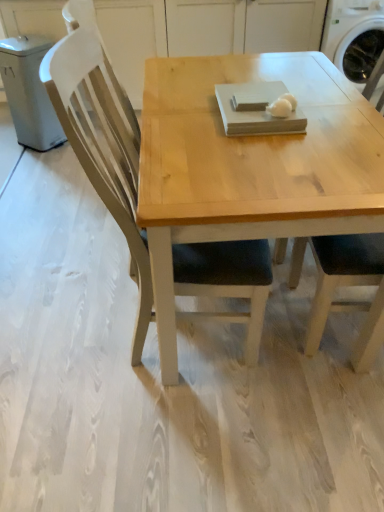
Question: Does white plastic washing machine at upper right have a larger size compared to white matte egg at center?

Choices:
 (A) no
 (B) yes

Answer: (B)

Question: Does white plastic washing machine at upper right have a lesser height compared to white matte egg at center?

Choices:
 (A) yes
 (B) no

Answer: (B)

Question: Considering the relative positions of white plastic washing machine at upper right and white matte egg at center in the image provided, is white plastic washing machine at upper right to the left of white matte egg at center from the viewer's perspective?

Choices:
 (A) no
 (B) yes

Answer: (A)

Question: Is white plastic washing machine at upper right positioned behind white matte egg at center?

Choices:
 (A) yes
 (B) no

Answer: (A)

Question: Can you confirm if white plastic washing machine at upper right is smaller than white matte egg at center?

Choices:
 (A) no
 (B) yes

Answer: (A)

Question: From the image's perspective, is matte wood chair at right above or below white plastic washing machine at upper right?

Choices:
 (A) above
 (B) below

Answer: (B)

Question: Based on their sizes in the image, would you say matte wood chair at right is bigger or smaller than white plastic washing machine at upper right?

Choices:
 (A) big
 (B) small

Answer: (B)

Question: Looking at their shapes, would you say matte wood chair at right is wider or thinner than white plastic washing machine at upper right?

Choices:
 (A) thin
 (B) wide

Answer: (A)

Question: Is matte wood chair at right taller or shorter than white plastic washing machine at upper right?

Choices:
 (A) tall
 (B) short

Answer: (A)

Question: From a real-world perspective, relative to white plastic washing machine at upper right, is white matte egg at center vertically above or below?

Choices:
 (A) below
 (B) above

Answer: (B)

Question: Considering the positions of white matte egg at center and white plastic washing machine at upper right in the image, is white matte egg at center taller or shorter than white plastic washing machine at upper right?

Choices:
 (A) tall
 (B) short

Answer: (B)

Question: Looking at their shapes, would you say white matte egg at center is wider or thinner than white plastic washing machine at upper right?

Choices:
 (A) thin
 (B) wide

Answer: (A)

Question: Would you say white matte egg at center is inside or outside white plastic washing machine at upper right?

Choices:
 (A) outside
 (B) inside

Answer: (A)

Question: From a real-world perspective, is white plastic washing machine at upper right positioned above or below matte wood chair at right?

Choices:
 (A) above
 (B) below

Answer: (B)

Question: Is point (365, 3) closer or farther from the camera than point (344, 245)?

Choices:
 (A) farther
 (B) closer

Answer: (A)